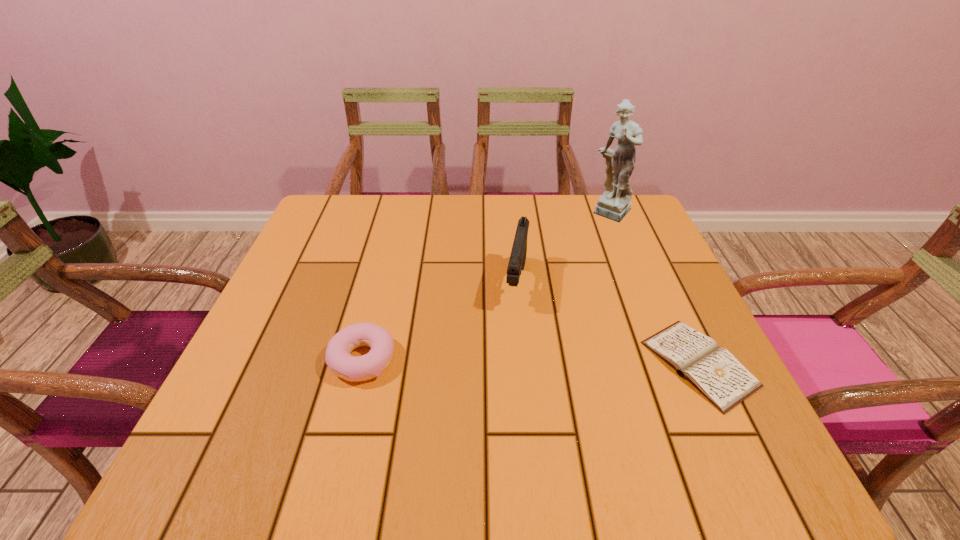
I want to click on unoccupied area between the leftmost object and the diary, so click(531, 362).

Locate an element on the screen. free area in between the tallest object and the doughnut is located at coordinates (x=488, y=287).

You are a GUI agent. You are given a task and a screenshot of the screen. Output one action in this format:
    pyautogui.click(x=<x>, y=<y>)
    Task: Click on the vacant area between the tallest object and the third nearest object
    This screenshot has height=540, width=960.
    Given the screenshot: What is the action you would take?
    pyautogui.click(x=564, y=248)

You are a GUI agent. You are given a task and a screenshot of the screen. Output one action in this format:
    pyautogui.click(x=<x>, y=<y>)
    Task: Click on the free point between the diary and the second tallest object
    
    Given the screenshot: What is the action you would take?
    pyautogui.click(x=608, y=323)

Find the location of `free space between the shortest object and the third tallest object`. free space between the shortest object and the third tallest object is located at coordinates (531, 362).

The height and width of the screenshot is (540, 960). What are the coordinates of `vacant space in between the doughnut and the third object from right to left` in the screenshot? It's located at (440, 322).

Image resolution: width=960 pixels, height=540 pixels. What are the coordinates of `vacant area between the second farthest object and the doughnut` in the screenshot? It's located at (440, 322).

The image size is (960, 540). What are the coordinates of `empty location between the figurine and the doughnut` in the screenshot? It's located at click(x=488, y=287).

Find the location of a particular element. This screenshot has height=540, width=960. blank region between the second tallest object and the farthest object is located at coordinates (564, 248).

Locate which object is the third closest to the leftmost object. Please provide its 2D coordinates. Your answer should be formatted as a tuple, i.e. [(x, y)], where the tuple contains the x and y coordinates of a point satisfying the conditions above.

[(614, 204)]